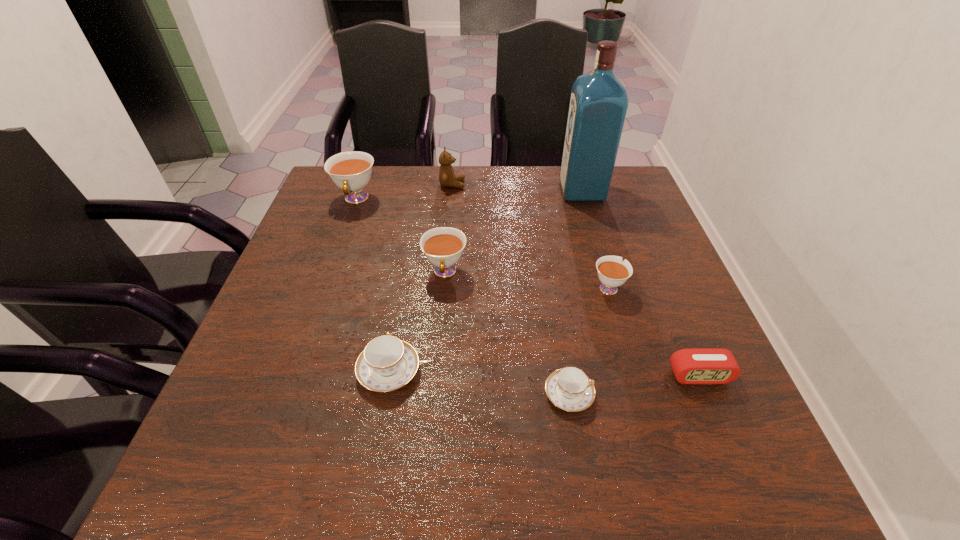
The image size is (960, 540). What are the coordinates of `the rightmost object` in the screenshot? It's located at (690, 366).

The width and height of the screenshot is (960, 540). I want to click on alarm clock, so click(x=690, y=366).

This screenshot has width=960, height=540. Find the location of `the shortest teacup`. the shortest teacup is located at coordinates (570, 389).

This screenshot has height=540, width=960. Find the location of `the smaller blue teacup`. the smaller blue teacup is located at coordinates (570, 389).

Identify the location of vacant space located on the flat label side of the tallest object. pos(520,191).

Identify the location of free space located 0.400m on the flat label side of the tallest object. (424, 191).

Where is `vacant space located 0.380m on the flat label side of the tallest object`? vacant space located 0.380m on the flat label side of the tallest object is located at coordinates (431, 191).

Where is `blank area located on the front-facing side of the teddy bear`? blank area located on the front-facing side of the teddy bear is located at coordinates (552, 184).

Identify the location of free space located on the side of the leftmost white teacup with the handle. This screenshot has width=960, height=540. (339, 248).

Find the location of a particular element. Image resolution: width=960 pixels, height=540 pixels. vacant space located on the side of the second biggest white teacup with the handle is located at coordinates (429, 461).